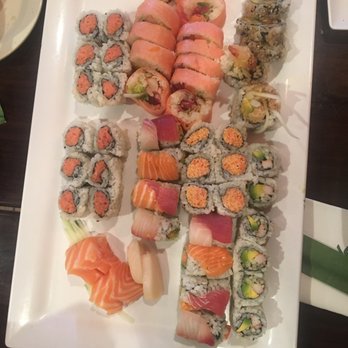
Locate an element on the screen. This screenshot has width=348, height=348. white rectangular plate is located at coordinates (53, 54), (44, 263), (137, 337), (283, 316), (296, 165), (299, 55).